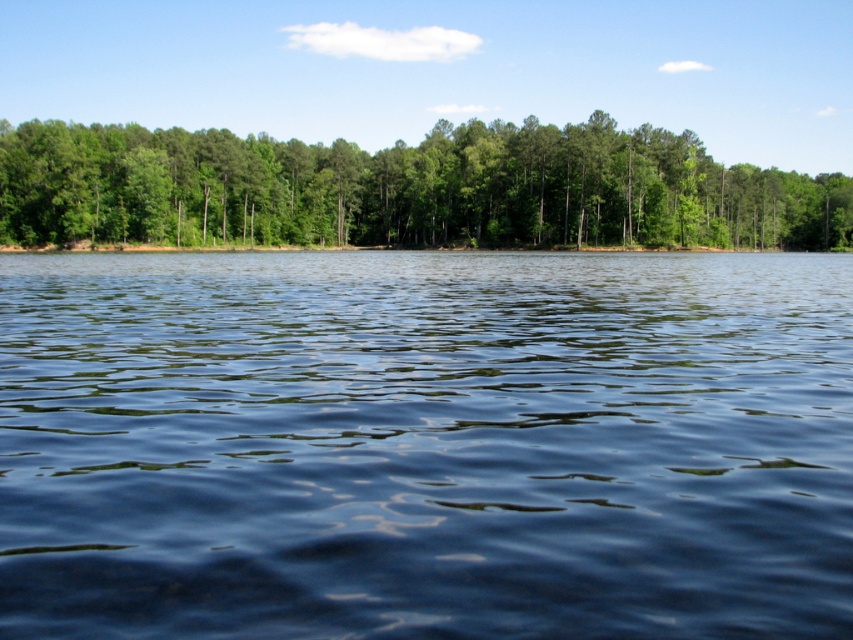
Consider the image. Can you confirm if dark blue water at center is thinner than green leafy trees at center?

Indeed, dark blue water at center has a lesser width compared to green leafy trees at center.

Which is more to the left, dark blue water at center or green leafy trees at center?

Positioned to the left is dark blue water at center.

You are a GUI agent. You are given a task and a screenshot of the screen. Output one action in this format:
    pyautogui.click(x=<x>, y=<y>)
    Task: Click on the dark blue water at center
    The image size is (853, 640).
    Given the screenshot: What is the action you would take?
    pyautogui.click(x=425, y=444)

The width and height of the screenshot is (853, 640). Find the location of `dark blue water at center`. dark blue water at center is located at coordinates (425, 444).